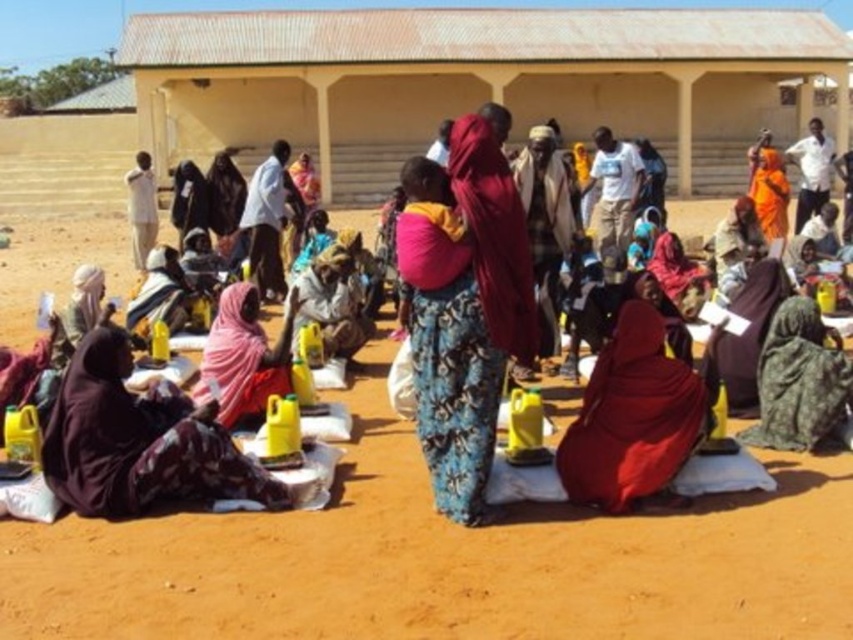
Question: Based on their relative distances, which object is farther from the camouflage fabric headscarf at lower right?

Choices:
 (A) matte red cloth at center
 (B) pink fabric headscarf at lower left

Answer: (B)

Question: Does brown sandy dirt at center have a smaller size compared to matte red cloth at center?

Choices:
 (A) yes
 (B) no

Answer: (B)

Question: Estimate the real-world distances between objects in this image. Which object is closer to the matte black turban at left?

Choices:
 (A) matte pink fabric at center
 (B) dark purple fabric at lower left
 (C) camouflage fabric headscarf at lower right

Answer: (B)

Question: Does matte red cloth at center have a larger size compared to matte black turban at left?

Choices:
 (A) yes
 (B) no

Answer: (A)

Question: Where is pink fabric headscarf at lower left located in relation to matte black turban at left in the image?

Choices:
 (A) below
 (B) above

Answer: (A)

Question: Which of these objects is positioned closest to the matte pink fabric at center?

Choices:
 (A) dark purple fabric at lower left
 (B) matte black turban at left

Answer: (A)